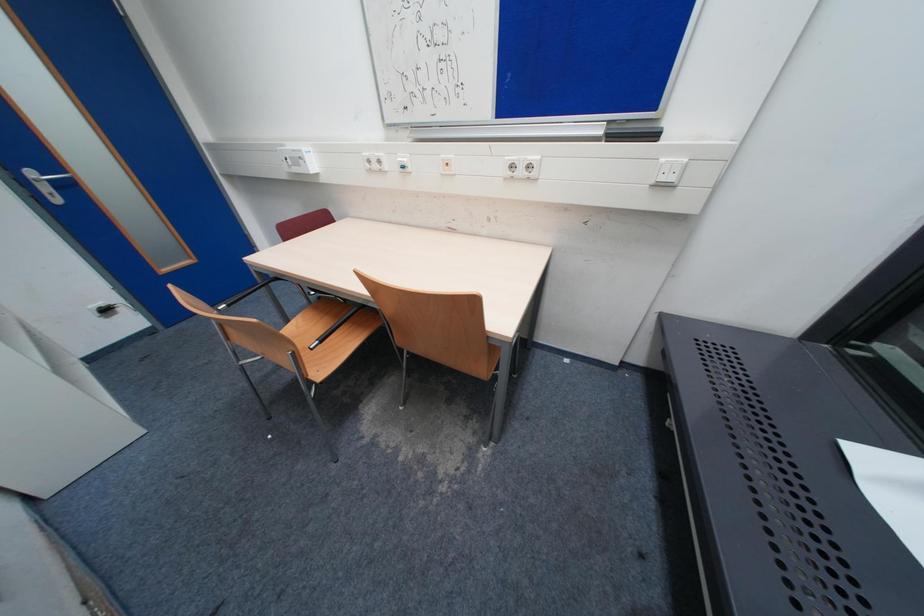
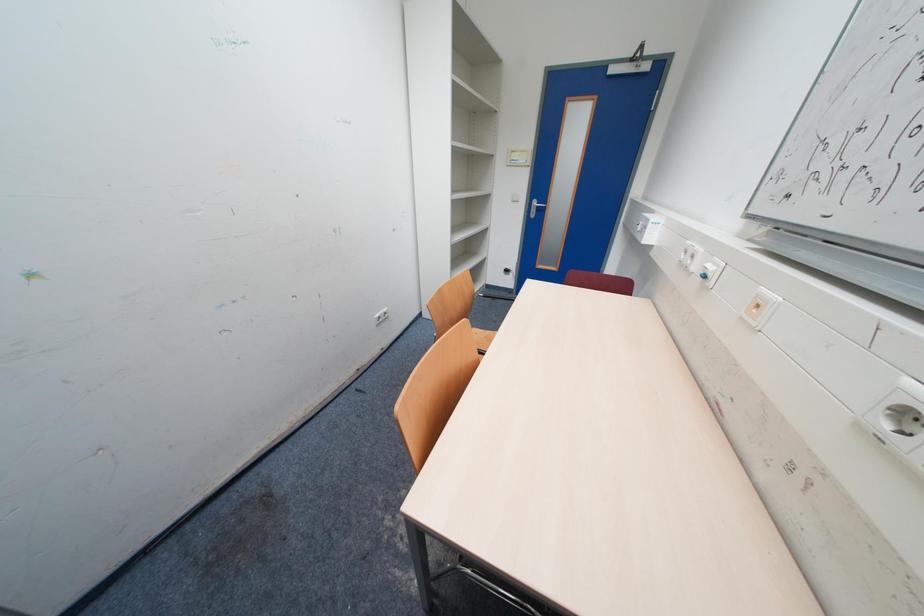
The first image is from the beginning of the video and the second image is from the end. How did the camera likely rotate when shooting the video?

The camera's rotation is toward left-down.